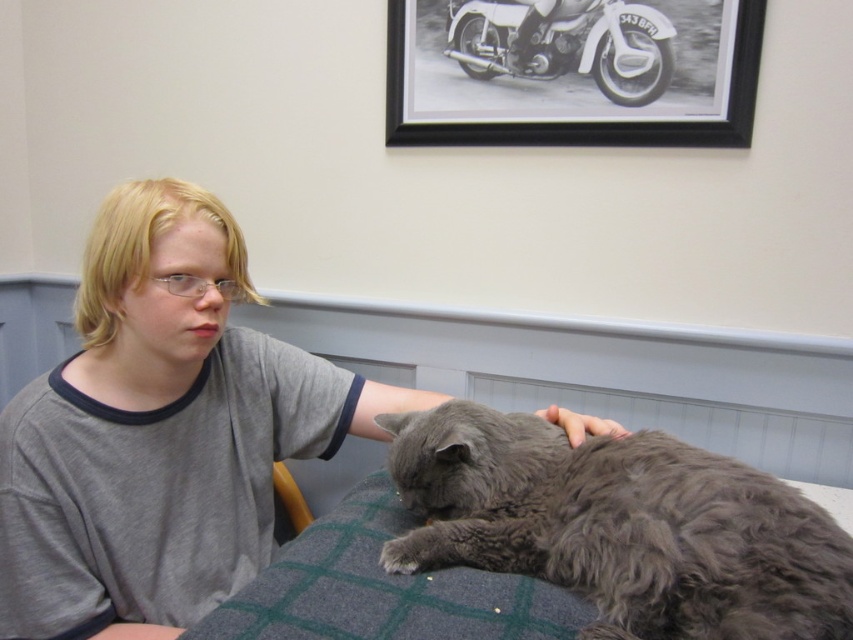
You are a photographer trying to capture a clear shot of the gray soft shirt at center and the gray fluffy cat at lower right. However, you notice that one of them is partially blocking the other. Which object is being blocked by the other?

The gray fluffy cat at lower right is behind gray soft shirt at center, so the cat is being blocked by the shirt.

You are a photographer trying to capture a photo of the gray fluffy cat at lower right and the white matte motorbike at upper center in the scene. Which object is shorter in height?

The gray fluffy cat at lower right is shorter in height than the white matte motorbike at upper center.